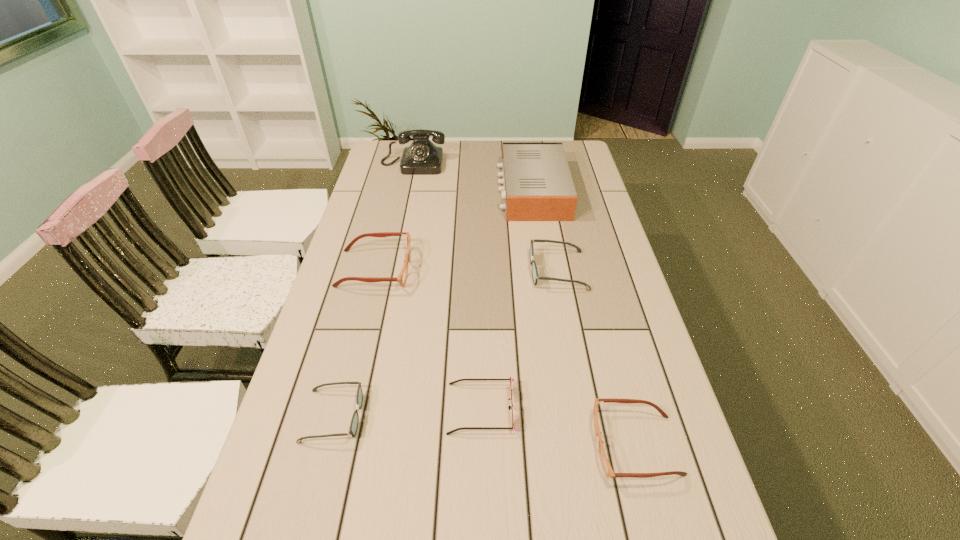
This screenshot has width=960, height=540. What are the coordinates of `free spot between the left gray spectacles and the sixth shortest object` in the screenshot? It's located at (433, 303).

At what (x,y) coordinates should I click in order to perform the action: click on free space between the bigger brown spectacles and the shortest spectacles. Please return your answer as a coordinate pair (x, y). The width and height of the screenshot is (960, 540). Looking at the image, I should click on (354, 342).

Locate an element on the screen. free space between the nearer brown spectacles and the second tallest object is located at coordinates (x=584, y=318).

The height and width of the screenshot is (540, 960). Identify the location of object that is the closest to the smaller brown spectacles. (511, 379).

Image resolution: width=960 pixels, height=540 pixels. In order to click on object that is the sixth closest to the farther gray spectacles in this screenshot , I will do `click(422, 157)`.

Image resolution: width=960 pixels, height=540 pixels. Identify the location of the third closest spectacles to the sixth shortest object. (606, 465).

Identify the location of spectacles identified as the third closest to the right brown spectacles. This screenshot has height=540, width=960. (401, 279).

In order to click on free spot that satisfies the following two spatial constraints: 1. on the dial of the tallest object; 2. on the face of the nearer gray spectacles in this screenshot , I will do `click(359, 416)`.

Locate an element on the screen. Image resolution: width=960 pixels, height=540 pixels. vacant space that satisfies the following two spatial constraints: 1. on the dial of the black telephone; 2. on the face of the left gray spectacles is located at coordinates (359, 416).

At what (x,y) coordinates should I click in order to perform the action: click on vacant point that satisfies the following two spatial constraints: 1. on the dial of the telephone; 2. on the face of the smaller gray spectacles. Please return your answer as a coordinate pair (x, y). Looking at the image, I should click on (359, 416).